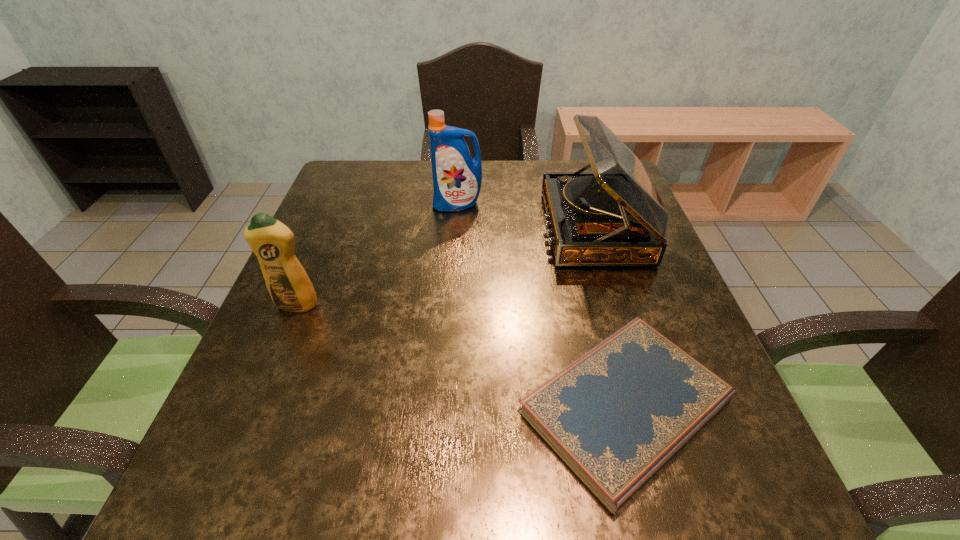
The width and height of the screenshot is (960, 540). What are the coordinates of `free space between the leftmost object and the record player` in the screenshot? It's located at (445, 266).

The width and height of the screenshot is (960, 540). In order to click on free space between the nearer detergent and the shortest object in this screenshot , I will do `click(461, 355)`.

The height and width of the screenshot is (540, 960). Find the location of `free space between the record player and the nearest object`. free space between the record player and the nearest object is located at coordinates tap(610, 316).

Identify the location of empty space that is in between the leftmost object and the record player. (445, 266).

This screenshot has width=960, height=540. I want to click on free space between the left detergent and the shortest object, so click(461, 355).

In order to click on vacant space that is in between the nearer detergent and the record player in this screenshot , I will do `click(445, 266)`.

The height and width of the screenshot is (540, 960). I want to click on empty space between the right detergent and the left detergent, so [x=377, y=255].

Identify which object is the second nearest to the record player. Please provide its 2D coordinates. Your answer should be formatted as a tuple, i.e. [(x, y)], where the tuple contains the x and y coordinates of a point satisfying the conditions above.

[(615, 416)]

Identify the location of the second closest object to the paperback book. The height and width of the screenshot is (540, 960). (289, 286).

This screenshot has height=540, width=960. I want to click on free location that satisfies the following two spatial constraints: 1. on the label of the paperback book; 2. on the left side of the third farthest object, so click(x=254, y=406).